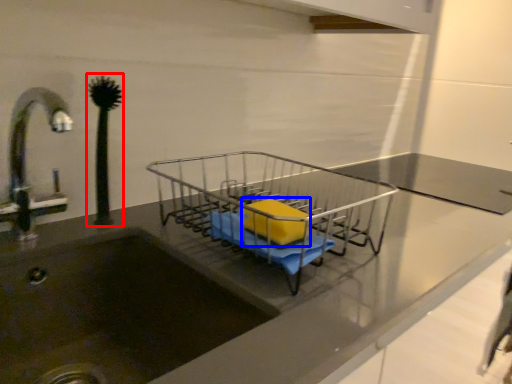
Question: Which object appears closest to the camera in this image, plant (highlighted by a red box) or material (highlighted by a blue box)?

Choices:
 (A) plant
 (B) material

Answer: (B)